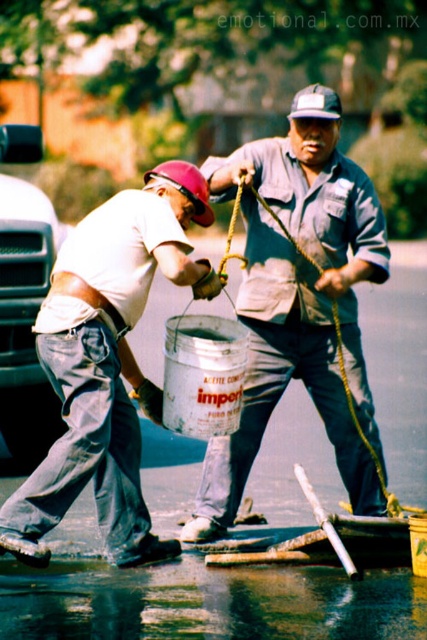
You are standing at the point labeled point [128,236] and want to move to the point labeled point [333,280]. Is the path between these two points sloping upwards or downwards?

The path between point [128,236] and point [333,280] is sloping upwards because point [333,280] is further to the camera than point [128,236], indicating a higher elevation.